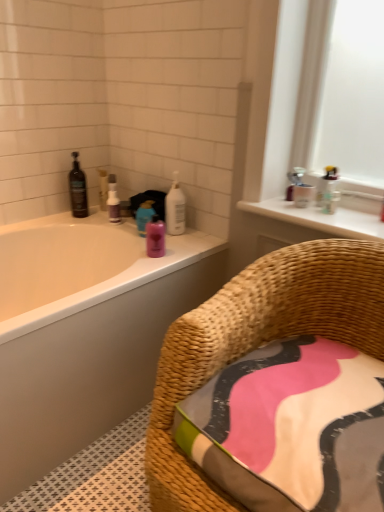
At what (x,y) coordinates should I click in order to perform the action: click on free location to the right of white glossy bottle at upper center, the 1th cleaning product when ordered from right to left. Please return your answer as a coordinate pair (x, y). Looking at the image, I should click on (199, 233).